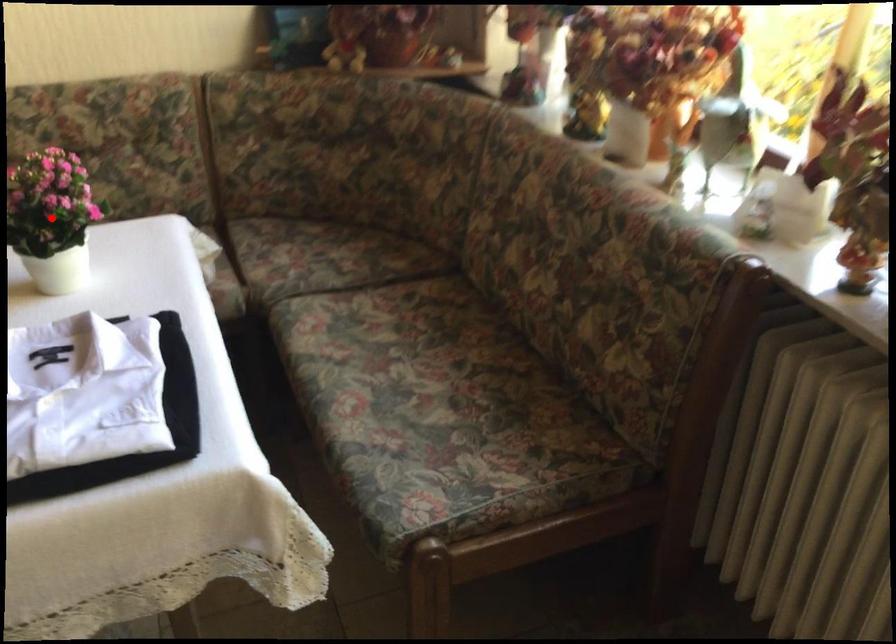
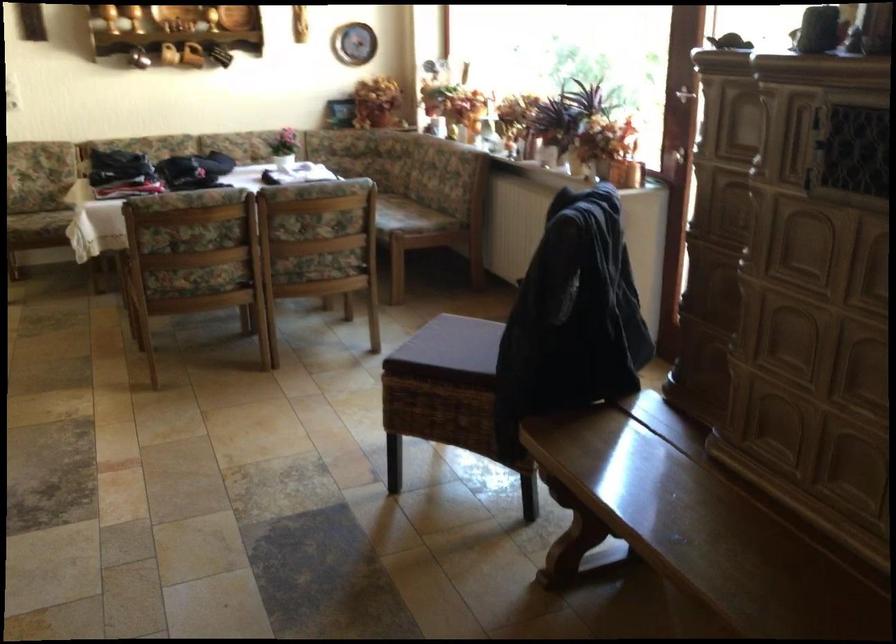
Question: I am providing you with two images of the same scene from different viewpoints. A red point is marked on the first image. At the location where the point appears in image 1, is it still visible in image 2?

Choices:
 (A) Yes
 (B) No

Answer: (B)